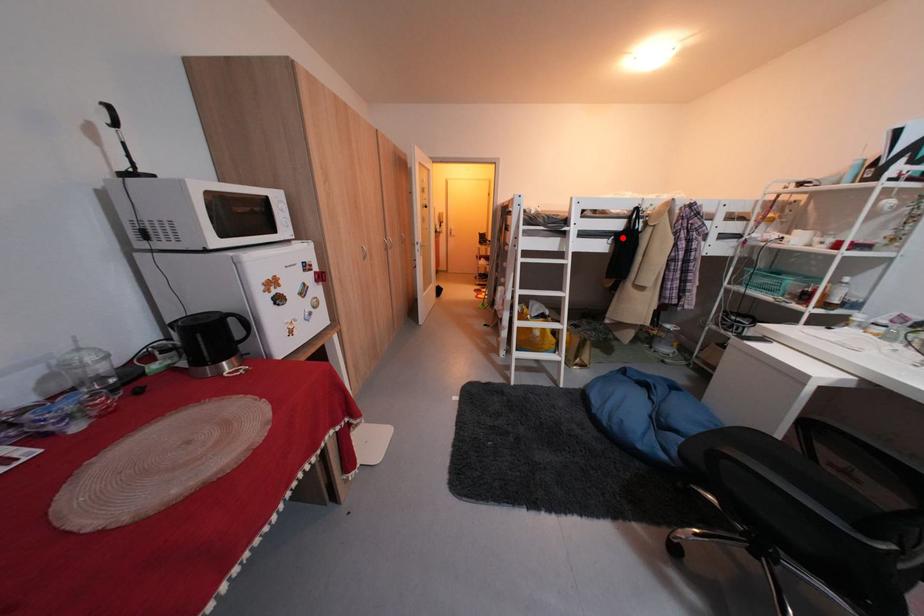
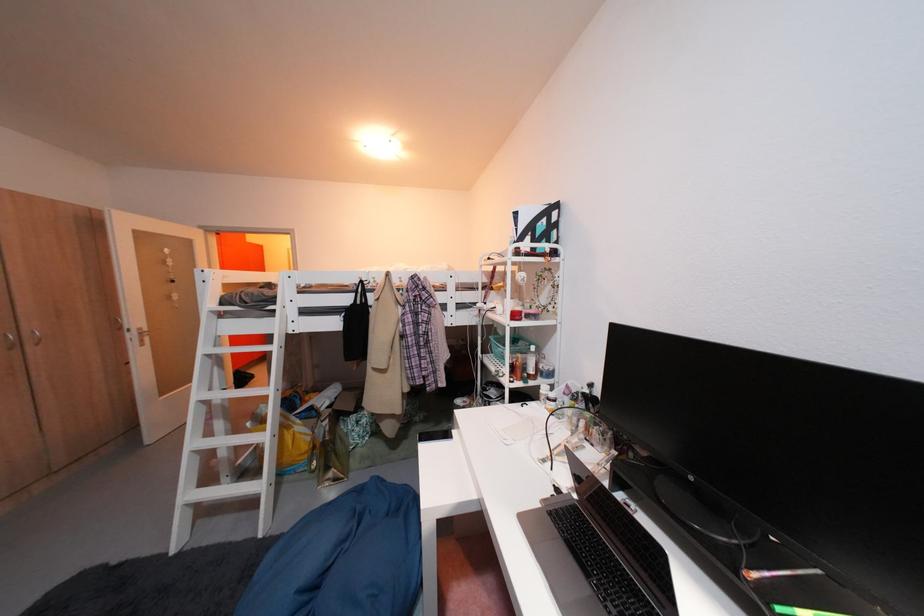
Where in the second image is the point corresponding to the highlighted location from the first image?

(354, 314)